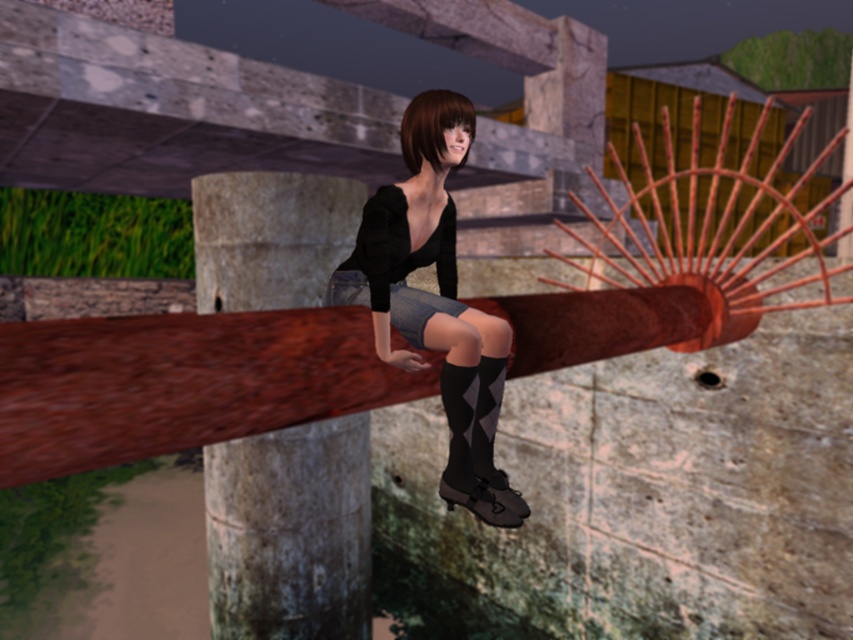
Does rusty metal pole at center come in front of black matte dress at center?

No, it is not.

Does rusty metal pole at center have a larger size compared to black matte dress at center?

Incorrect, rusty metal pole at center is not larger than black matte dress at center.

Between point (260, 612) and point (387, 300), which one is positioned behind?

Positioned behind is point (260, 612).

Identify the location of rusty metal pole at center. The image size is (853, 640). (289, 531).

Can you confirm if matte black sweater at center is shorter than black textured sock at lower center?

No.

Is matte black sweater at center bigger than black textured sock at lower center?

Yes, matte black sweater at center is bigger than black textured sock at lower center.

Between point (451, 218) and point (471, 410), which one is positioned behind?

Positioned behind is point (451, 218).

Find the location of a particular element. Image resolution: width=853 pixels, height=640 pixels. matte black sweater at center is located at coordinates pyautogui.click(x=434, y=300).

Between black matte dress at center and black textured sock at lower center, which one has less height?

Standing shorter between the two is black textured sock at lower center.

From the picture: Does black matte dress at center have a greater height compared to black textured sock at lower center?

Correct, black matte dress at center is much taller as black textured sock at lower center.

Where is `black matte dress at center`? black matte dress at center is located at coordinates (397, 266).